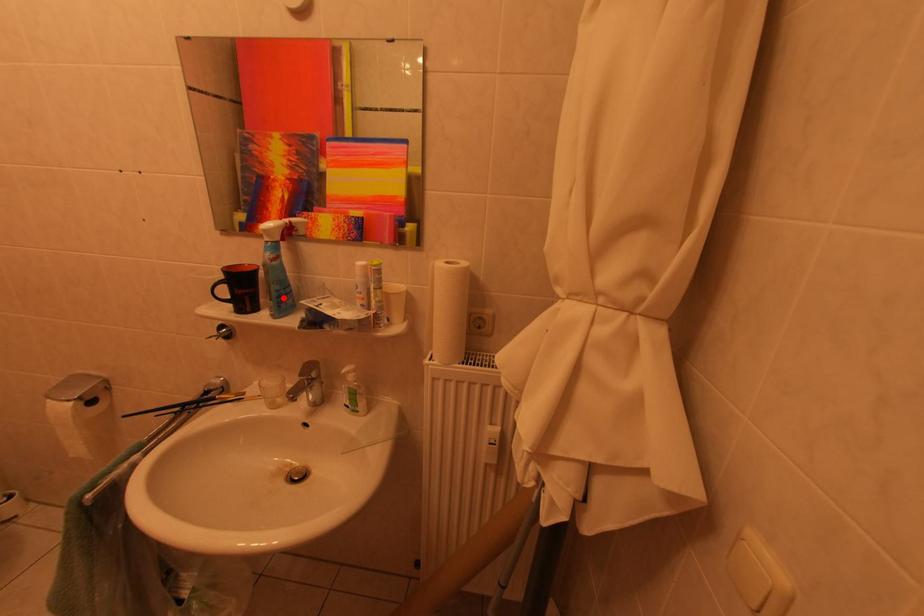
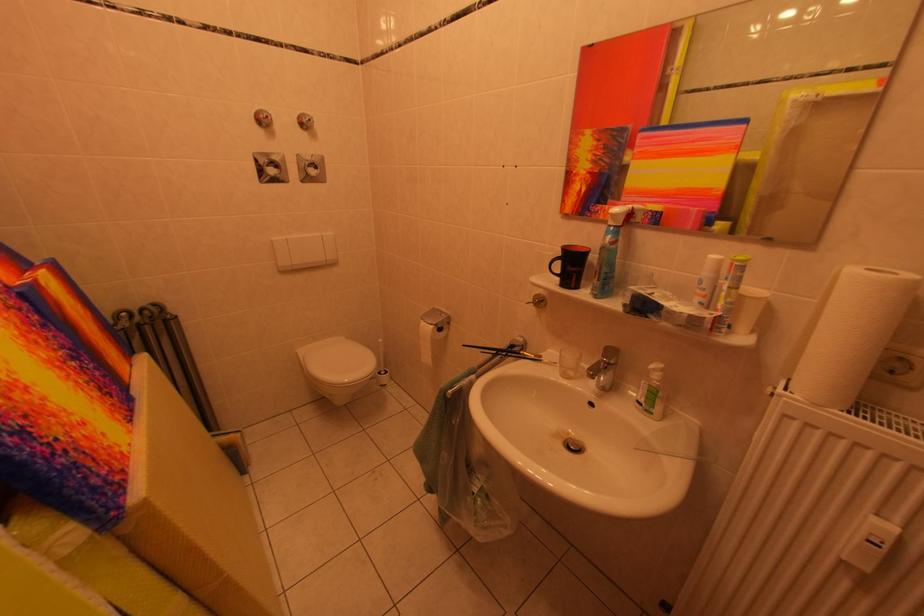
Find the pixel in the second image that matches the highlighted location in the first image.

(613, 280)